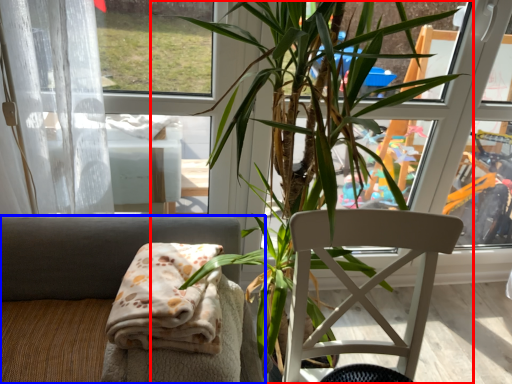
Question: Which of the following is the farthest to the observer, houseplant (highlighted by a red box) or chair (highlighted by a blue box)?

Choices:
 (A) houseplant
 (B) chair

Answer: (B)